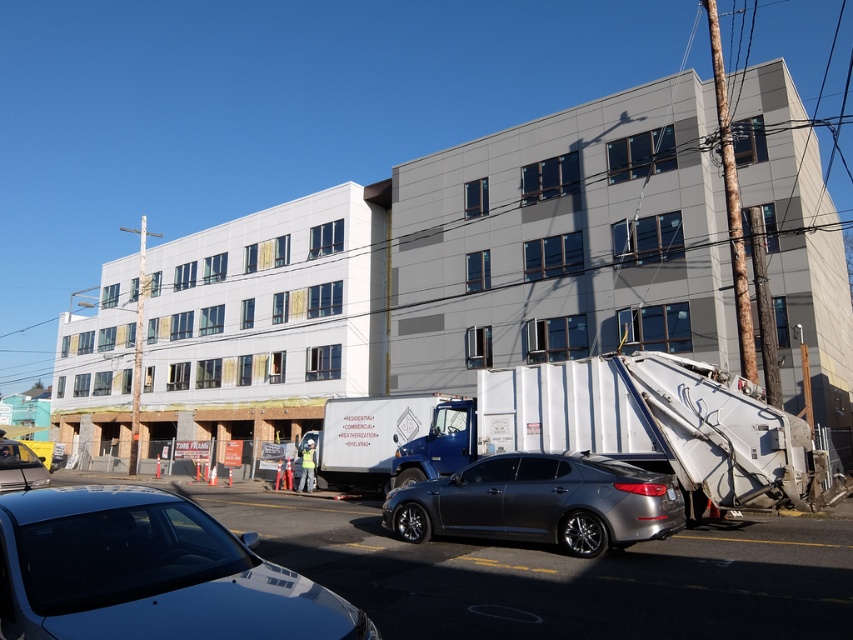
Is white metallic garbage truck at lower right taller than satin gray sedan at center?

No, white metallic garbage truck at lower right is not taller than satin gray sedan at center.

Is white metallic garbage truck at lower right below satin gray sedan at center?

Actually, white metallic garbage truck at lower right is above satin gray sedan at center.

Does point (514, 372) lie behind point (437, 525)?

Yes, it is.

At what (x,y) coordinates should I click in order to perform the action: click on white metallic garbage truck at lower right. Please return your answer as a coordinate pair (x, y). The image size is (853, 640). Looking at the image, I should click on (631, 428).

In the scene shown: Is the position of satin gray sedan at center less distant than that of shiny silver sedan at lower left?

That is True.

Is point (496, 531) in front of point (41, 480)?

Yes, point (496, 531) is closer to viewer.

This screenshot has width=853, height=640. What do you see at coordinates (541, 502) in the screenshot?
I see `satin gray sedan at center` at bounding box center [541, 502].

Identify the location of satin gray sedan at center. The image size is (853, 640). (x=541, y=502).

At what (x,y) coordinates should I click in order to perform the action: click on shiny black sedan at lower left. Please return your answer as a coordinate pair (x, y). The image size is (853, 640). Looking at the image, I should click on (148, 572).

This screenshot has width=853, height=640. Describe the element at coordinates (148, 572) in the screenshot. I see `shiny black sedan at lower left` at that location.

This screenshot has width=853, height=640. Identify the location of shiny black sedan at lower left. (148, 572).